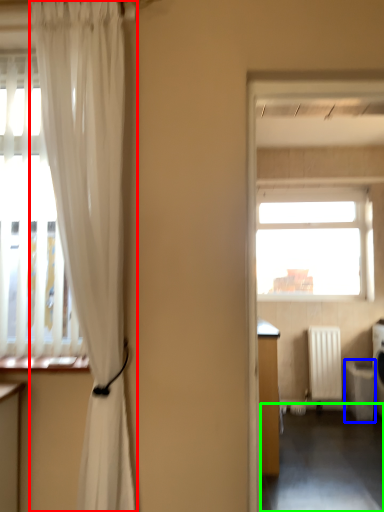
Question: Which object is the closest to the curtain (highlighted by a red box)? Choose among these: dish washer (highlighted by a blue box) or corridor (highlighted by a green box).

Choices:
 (A) dish washer
 (B) corridor

Answer: (B)